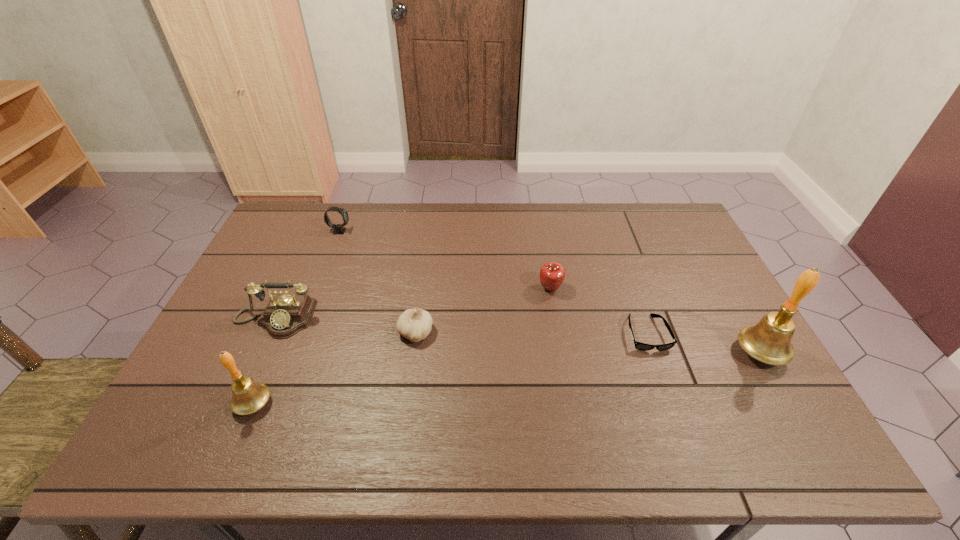
In order to click on the shorter bell in this screenshot , I will do `click(249, 396)`.

Find the location of `the nearest object`. the nearest object is located at coordinates 249,396.

You are a GUI agent. You are given a task and a screenshot of the screen. Output one action in this format:
    pyautogui.click(x=<x>, y=<y>)
    Task: Click on the tallest object
    
    Given the screenshot: What is the action you would take?
    pyautogui.click(x=769, y=341)

Where is `the right bell`? the right bell is located at coordinates (769, 341).

The height and width of the screenshot is (540, 960). Find the location of `the farthest object`. the farthest object is located at coordinates (338, 229).

Where is `the fourth object from left to right`? The width and height of the screenshot is (960, 540). the fourth object from left to right is located at coordinates (415, 324).

Where is `the second object from right to left`? The image size is (960, 540). the second object from right to left is located at coordinates (638, 345).

This screenshot has height=540, width=960. Identify the location of the shortest object. (638, 345).

The width and height of the screenshot is (960, 540). In order to click on the sixth nearest object in this screenshot , I will do `click(552, 274)`.

This screenshot has height=540, width=960. I want to click on apple, so click(552, 274).